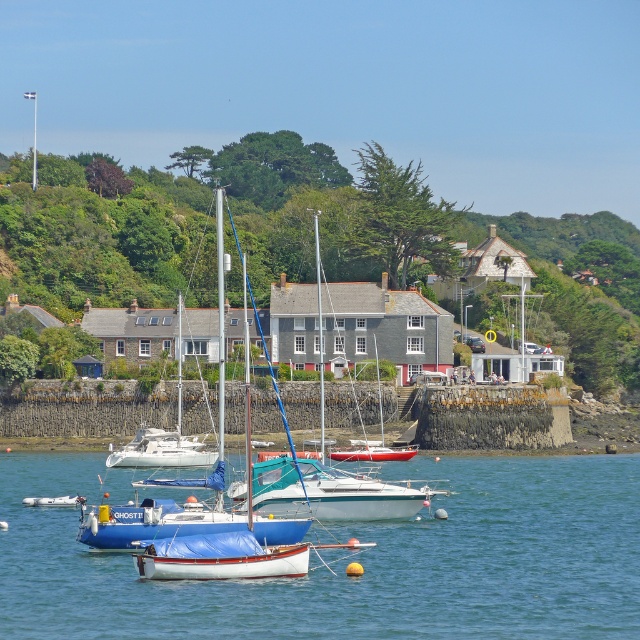
Question: Which point is closer to the camera taking this photo?

Choices:
 (A) (259, 461)
 (B) (35, 497)
 (C) (250, 634)
 (D) (196, 541)

Answer: (C)

Question: Estimate the real-world distances between objects in this image. Which object is closer to the blue water at center?

Choices:
 (A) blue matte sailboat at center
 (B) white matte sailboat at center

Answer: (A)

Question: Observing the image, what is the correct spatial positioning of teal glossy sailboat at center in reference to white matte sailboat at center?

Choices:
 (A) above
 (B) below

Answer: (A)

Question: Observing the image, what is the correct spatial positioning of blue water at center in reference to teal glossy sailboat at center?

Choices:
 (A) above
 (B) below

Answer: (B)

Question: Among these objects, which one is nearest to the camera?

Choices:
 (A) blue matte sailboat at center
 (B) white matte sailboat at center
 (C) blue water at center

Answer: (C)

Question: Does blue water at center appear over white matte sailboat at center?

Choices:
 (A) yes
 (B) no

Answer: (B)